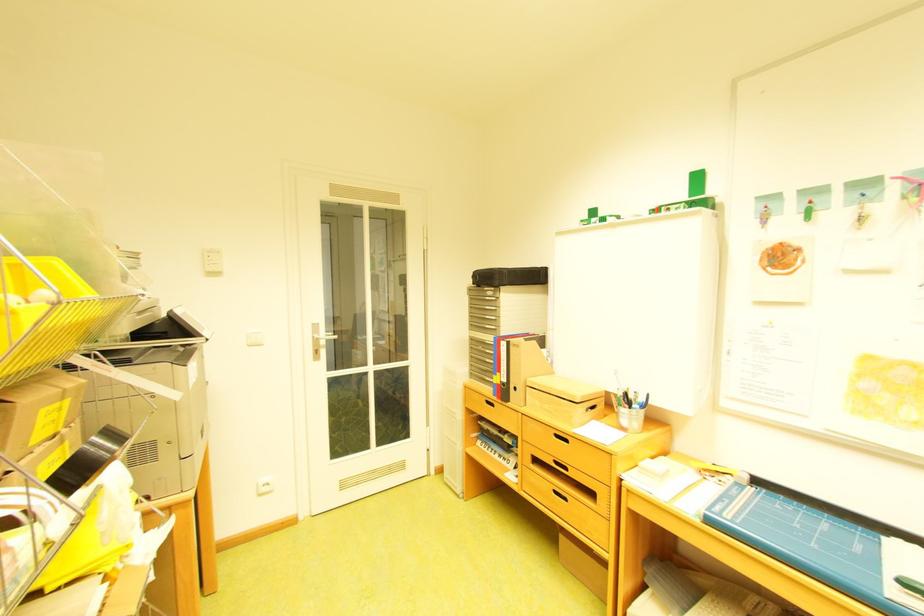
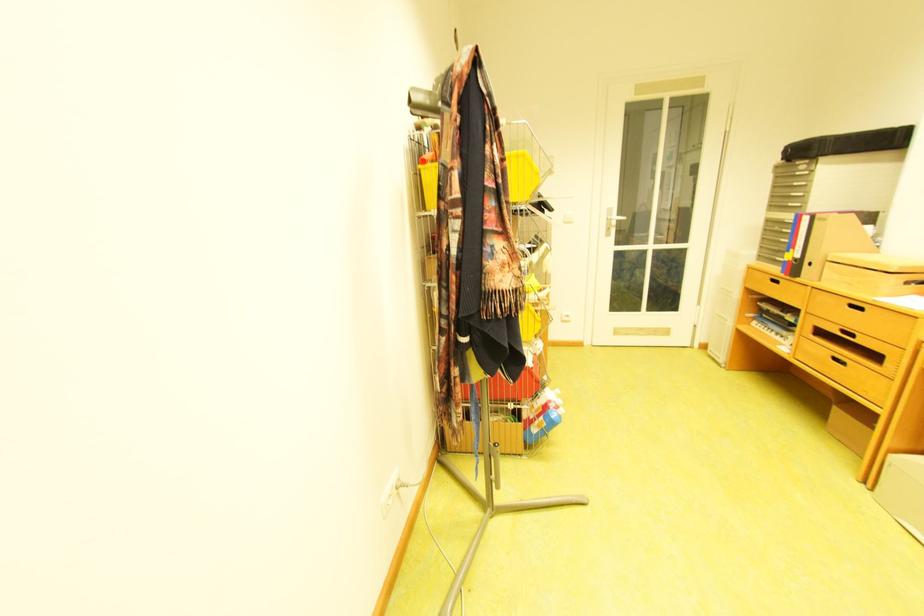
Locate, in the second image, the point that corresponds to point 511,272 in the first image.

(832, 140)